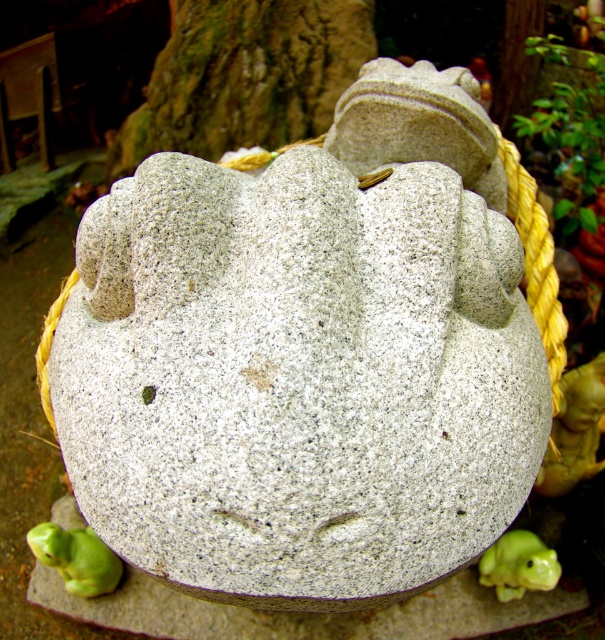
You are an art curator planning to move the gray granite frog at center and the granite statue at upper center to a new gallery layout. If you want to keep the same spatial relationship between them as in the original image, which object should be placed closer to the entrance so visitors see it first?

The gray granite frog at center should be placed closer to the entrance because it is closer to the viewer than the granite statue at upper center in the original image.

You are an art curator planning to move the gray granite frog at center and the granite statue at upper center to a new exhibition space. The new space has a narrow corridor that only allows moving one object at a time. Based on their positions in the current scene, which object should you move first to maintain their original spatial relationship?

You should move the gray granite frog at center first because it is positioned on the left side of the granite statue at upper center. By moving the frog first, you can place it in the new location and then position the statue to its right, preserving their original left to right arrangement.

You are an art curator planning to move the green stone frog at lower left and the green textured rock at upper center to a new exhibition space. The entrance of the new space has a narrow doorway that can only accommodate objects up to 1 meter in width. Based on the information provided, which object might not fit through the doorway?

The green textured rock at upper center might not fit through the doorway since it might be wider than the green stone frog at lower left, and the doorway has a 1 meter width limit.